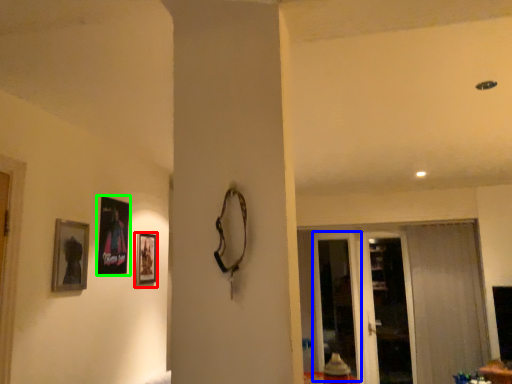
Question: Estimate the real-world distances between objects in this image. Which object is farther from picture frame (highlighted by a red box), screen door (highlighted by a blue box) or picture frame (highlighted by a green box)?

Choices:
 (A) screen door
 (B) picture frame

Answer: (A)